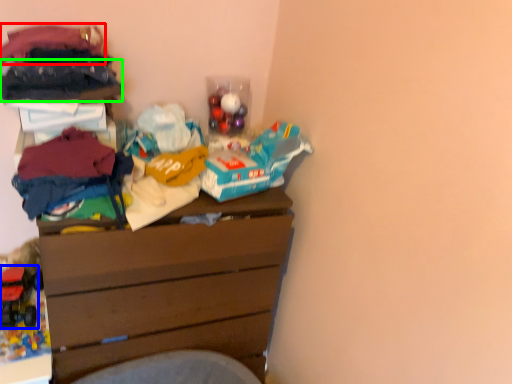
Question: Which object is the farthest from clothing (highlighted by a red box)? Choose among these: toy (highlighted by a blue box) or clothing (highlighted by a green box).

Choices:
 (A) toy
 (B) clothing

Answer: (A)